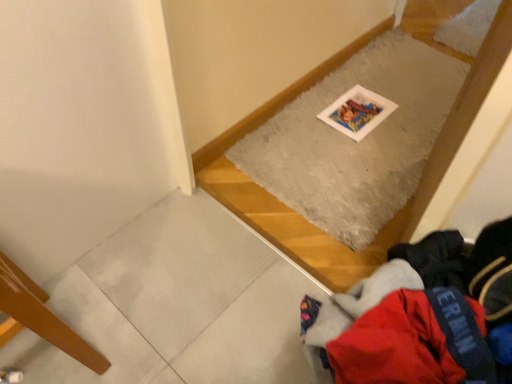
At what (x,y) coordinates should I click in order to perform the action: click on empty space that is ontop of gray fluffy mat at upper center (from a real-world perspective). Please return your answer as a coordinate pair (x, y). The height and width of the screenshot is (384, 512). Looking at the image, I should click on (377, 117).